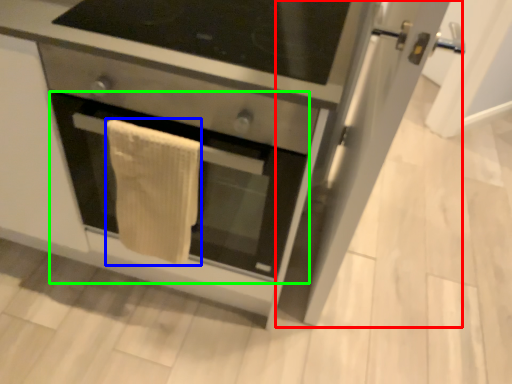
Question: Which object is the closest to the glass door (highlighted by a red box)? Choose among these: bath towel (highlighted by a blue box) or oven (highlighted by a green box).

Choices:
 (A) bath towel
 (B) oven

Answer: (B)